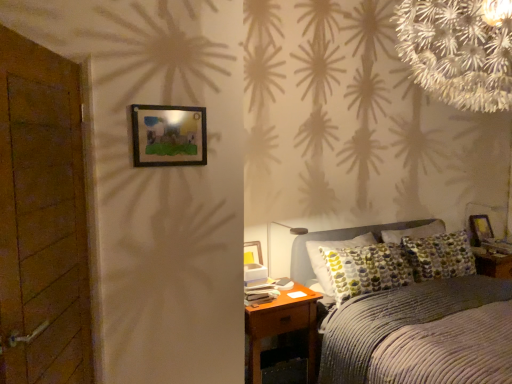
Question: Does wooden door at left have a lesser width compared to wooden picture frame at right, the second picture frame from the front?

Choices:
 (A) yes
 (B) no

Answer: (B)

Question: From the image's perspective, does wooden door at left appear lower than wooden picture frame at right, the 2th picture frame positioned from the left?

Choices:
 (A) no
 (B) yes

Answer: (A)

Question: Is wooden door at left closer to camera compared to wooden picture frame at right, the first picture frame when ordered from bottom to top?

Choices:
 (A) no
 (B) yes

Answer: (B)

Question: Does wooden door at left have a greater height compared to wooden picture frame at right, which is the 2th picture frame in top-to-bottom order?

Choices:
 (A) no
 (B) yes

Answer: (B)

Question: Does wooden door at left have a smaller size compared to wooden picture frame at right, the first picture frame when ordered from bottom to top?

Choices:
 (A) yes
 (B) no

Answer: (B)

Question: Do you think brown wooden nightstand at lower right is within wooden door at left, or outside of it?

Choices:
 (A) inside
 (B) outside

Answer: (B)

Question: From a real-world perspective, is brown wooden nightstand at lower right above or below wooden door at left?

Choices:
 (A) below
 (B) above

Answer: (A)

Question: Is brown wooden nightstand at lower right bigger or smaller than wooden door at left?

Choices:
 (A) small
 (B) big

Answer: (A)

Question: Visually, is brown wooden nightstand at lower right positioned to the left or to the right of wooden door at left?

Choices:
 (A) right
 (B) left

Answer: (A)

Question: From a real-world perspective, is brown wooden nightstand at lower right physically located above or below matte gray table lamp at center?

Choices:
 (A) above
 (B) below

Answer: (B)

Question: In terms of size, does brown wooden nightstand at lower right appear bigger or smaller than matte gray table lamp at center?

Choices:
 (A) big
 (B) small

Answer: (A)

Question: From the image's perspective, is brown wooden nightstand at lower right above or below matte gray table lamp at center?

Choices:
 (A) below
 (B) above

Answer: (A)

Question: Considering the positions of brown wooden nightstand at lower right and matte gray table lamp at center in the image, is brown wooden nightstand at lower right taller or shorter than matte gray table lamp at center?

Choices:
 (A) short
 (B) tall

Answer: (B)

Question: Looking at the image, does brown wooden nightstand at lower right seem bigger or smaller compared to wooden picture frame at right, which is the first picture frame in back-to-front order?

Choices:
 (A) small
 (B) big

Answer: (B)

Question: Is brown wooden nightstand at lower right wider or thinner than wooden picture frame at right, the first picture frame when ordered from bottom to top?

Choices:
 (A) thin
 (B) wide

Answer: (B)